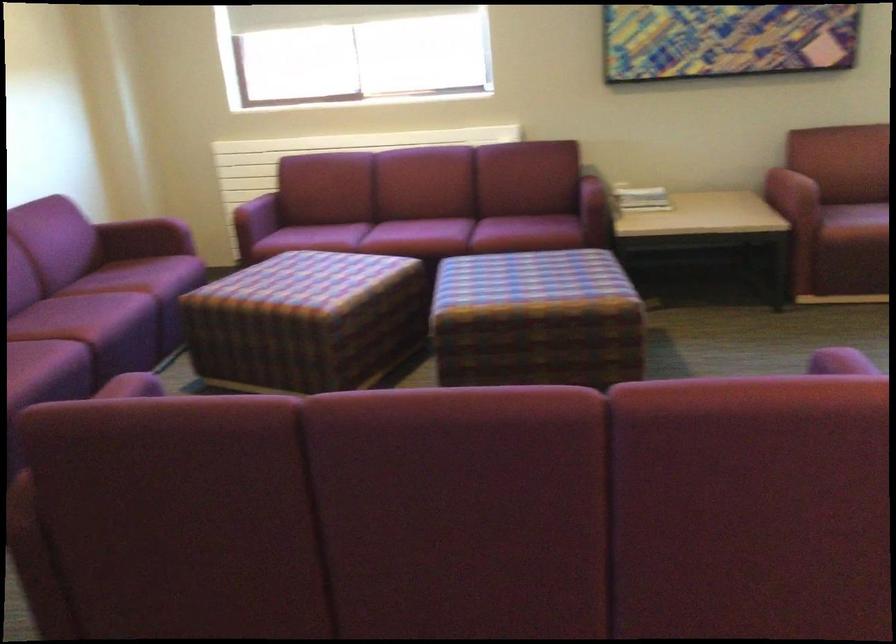
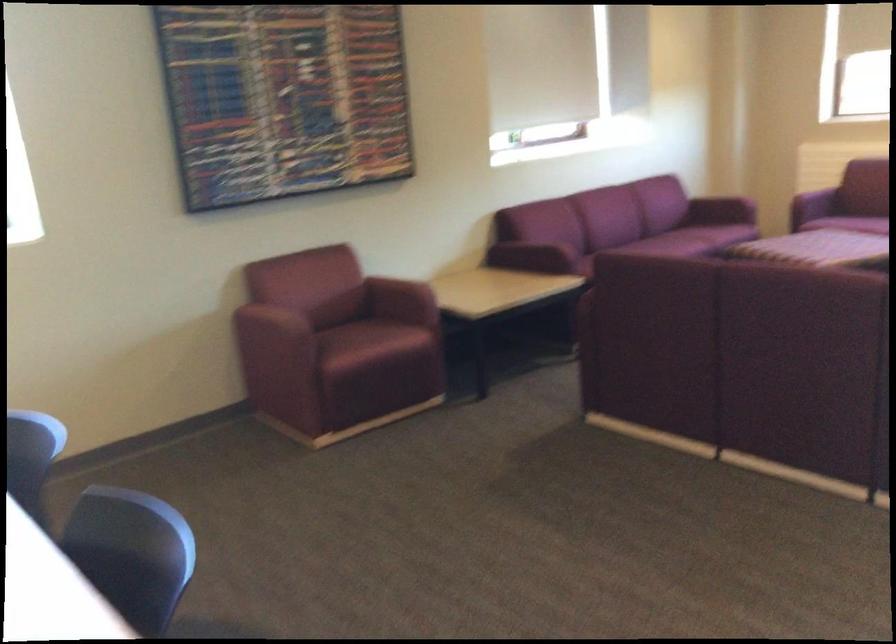
The point at (151, 238) is marked in the first image. Where is the corresponding point in the second image?

(720, 211)